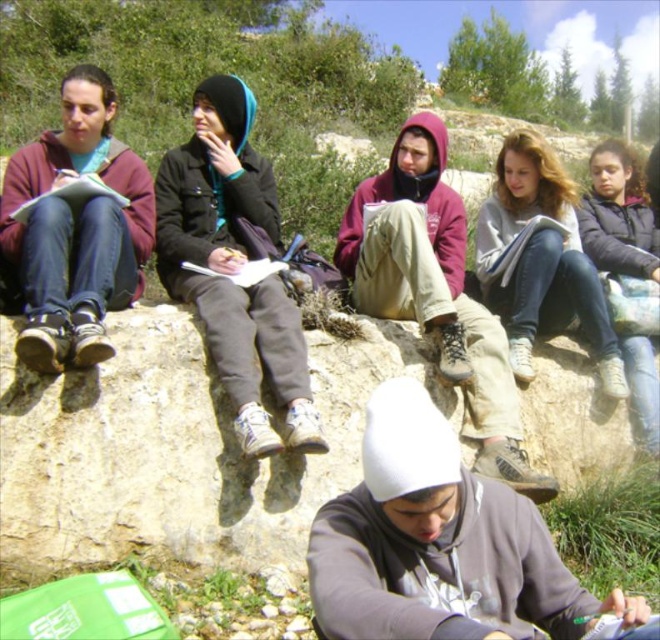
Question: Is dark gray fleece jacket at center to the right of matte black shoes at left from the viewer's perspective?

Choices:
 (A) yes
 (B) no

Answer: (A)

Question: Is brown rough rock at center smaller than dark gray fleece jacket at center?

Choices:
 (A) no
 (B) yes

Answer: (B)

Question: Which of the following is the closest to the observer?

Choices:
 (A) (387, 316)
 (B) (255, 372)
 (C) (653, 349)
 (D) (496, 259)

Answer: (B)

Question: Which point is farther to the camera?

Choices:
 (A) matte black shoes at left
 (B) gray hoodie at center
 (C) dark gray fleece jacket at center
 (D) maroon hoodie at center

Answer: (B)

Question: Can you confirm if brown rough rock at center is smaller than dark gray fleece jacket at center?

Choices:
 (A) no
 (B) yes

Answer: (B)

Question: Which of the following is the closest to the observer?

Choices:
 (A) (517, 196)
 (B) (457, 381)
 (C) (187, 285)
 (D) (649, 344)

Answer: (B)